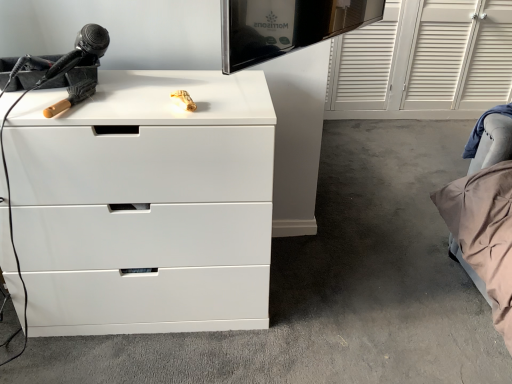
Question: Can you confirm if white glossy chest of drawers at upper left is bigger than white glossy dresser at center?

Choices:
 (A) no
 (B) yes

Answer: (A)

Question: Is white glossy chest of drawers at upper left at the left side of white glossy dresser at center?

Choices:
 (A) yes
 (B) no

Answer: (A)

Question: Does white glossy chest of drawers at upper left have a greater height compared to white glossy dresser at center?

Choices:
 (A) yes
 (B) no

Answer: (A)

Question: Is white glossy chest of drawers at upper left oriented away from white glossy dresser at center?

Choices:
 (A) no
 (B) yes

Answer: (A)

Question: Considering the relative sizes of white glossy chest of drawers at upper left and white glossy dresser at center in the image provided, is white glossy chest of drawers at upper left shorter than white glossy dresser at center?

Choices:
 (A) yes
 (B) no

Answer: (B)

Question: From a real-world perspective, does white glossy chest of drawers at upper left stand above white glossy dresser at center?

Choices:
 (A) no
 (B) yes

Answer: (B)

Question: Is white glossy dresser at center positioned behind white glossy chest of drawers at upper left?

Choices:
 (A) yes
 (B) no

Answer: (A)

Question: From the image's perspective, is white glossy dresser at center located beneath white glossy chest of drawers at upper left?

Choices:
 (A) yes
 (B) no

Answer: (B)

Question: Is white glossy dresser at center placed right next to white glossy chest of drawers at upper left?

Choices:
 (A) no
 (B) yes

Answer: (A)

Question: Could you tell me if white glossy dresser at center is turned towards white glossy chest of drawers at upper left?

Choices:
 (A) yes
 (B) no

Answer: (B)

Question: Can you confirm if white glossy dresser at center is bigger than white glossy chest of drawers at upper left?

Choices:
 (A) yes
 (B) no

Answer: (A)

Question: From a real-world perspective, is white glossy dresser at center beneath white glossy chest of drawers at upper left?

Choices:
 (A) no
 (B) yes

Answer: (B)

Question: Is white glossy dresser at center taller or shorter than white glossy chest of drawers at upper left?

Choices:
 (A) short
 (B) tall

Answer: (A)